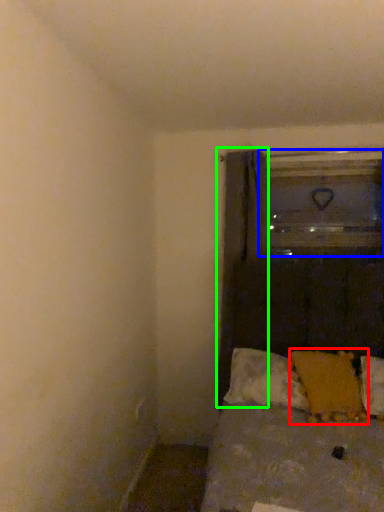
Question: Which object is the closest to the pillow (highlighted by a red box)? Choose among these: glass door (highlighted by a blue box) or curtain (highlighted by a green box).

Choices:
 (A) glass door
 (B) curtain

Answer: (B)